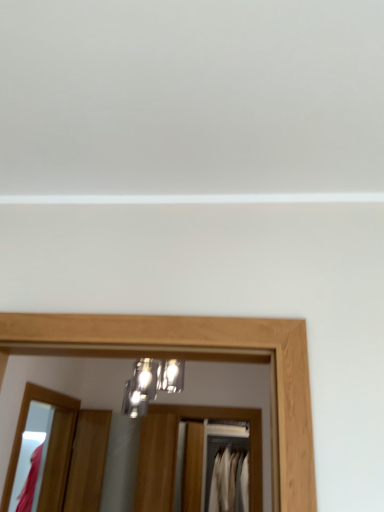
Image resolution: width=384 pixels, height=512 pixels. What do you see at coordinates (87, 461) in the screenshot?
I see `wooden door at lower left` at bounding box center [87, 461].

In order to face metallic glass light fixture at center, should I rotate leftwards or rightwards?

Rotate left and turn 5.225 degrees.

Image resolution: width=384 pixels, height=512 pixels. What are the coordinates of `metallic glass light fixture at center` in the screenshot? It's located at (151, 384).

This screenshot has height=512, width=384. Describe the element at coordinates (30, 482) in the screenshot. I see `matte pink fabric at left, the 2th clothing when ordered from right to left` at that location.

What is the approximate width of matte wooden mirror at lower left?

matte wooden mirror at lower left is 10.00 inches in width.

Identify the location of wooden door at lower left. The height and width of the screenshot is (512, 384). (87, 461).

Considering the relative sizes of wooden door at lower left and white fabric at center, acting as the second clothing starting from the front, in the image provided, is wooden door at lower left thinner than white fabric at center, acting as the second clothing starting from the front,?

Correct, the width of wooden door at lower left is less than that of white fabric at center, acting as the second clothing starting from the front.

This screenshot has width=384, height=512. I want to click on door above the white fabric at center, marked as the first clothing in a back-to-front arrangement (from a real-world perspective), so click(87, 461).

Considering their positions, is wooden door at lower left located in front of or behind white fabric at center, acting as the second clothing starting from the front?

wooden door at lower left is in front of white fabric at center, acting as the second clothing starting from the front.

Can we say matte pink fabric at left, the 2th clothing when ordered from right to left, lies outside metallic glass light fixture at center?

Absolutely, matte pink fabric at left, the 2th clothing when ordered from right to left, is external to metallic glass light fixture at center.

In the scene shown: Who is taller, matte pink fabric at left, the first clothing from the left, or metallic glass light fixture at center?

matte pink fabric at left, the first clothing from the left.

Which object is thinner, matte pink fabric at left, the 2th clothing when ordered from right to left, or metallic glass light fixture at center?

matte pink fabric at left, the 2th clothing when ordered from right to left.

From the image's perspective, which is below, white fabric at center, marked as the first clothing in a back-to-front arrangement, or metallic glass light fixture at center?

white fabric at center, marked as the first clothing in a back-to-front arrangement, appears lower in the image.

Does white fabric at center, which ranks as the 1th clothing in right-to-left order, have a larger size compared to metallic glass light fixture at center?

Yes.

Who is more distant, white fabric at center, acting as the second clothing starting from the front, or metallic glass light fixture at center?

white fabric at center, acting as the second clothing starting from the front, is further away from the camera.

Identify the location of light fixture above the white fabric at center, which ranks as the 1th clothing in right-to-left order (from the image's perspective). (151, 384).

Is wooden door at lower left surrounded by metallic glass light fixture at center?

No, metallic glass light fixture at center does not contain wooden door at lower left.

Considering the relative sizes of metallic glass light fixture at center and wooden door at lower left in the image provided, is metallic glass light fixture at center smaller than wooden door at lower left?

No, metallic glass light fixture at center is not smaller than wooden door at lower left.

Considering their positions, is metallic glass light fixture at center located in front of or behind wooden door at lower left?

Clearly, metallic glass light fixture at center is in front of wooden door at lower left.

Which is further, (41, 507) or (151, 384)?

The point (41, 507) is more distant.

In the scene shown: From a real-world perspective, is matte wooden mirror at lower left located beneath metallic glass light fixture at center?

Yes, from a real-world perspective, matte wooden mirror at lower left is beneath metallic glass light fixture at center.

In terms of width, does matte wooden mirror at lower left look wider or thinner when compared to metallic glass light fixture at center?

matte wooden mirror at lower left is wider than metallic glass light fixture at center.

Is matte wooden mirror at lower left in front of metallic glass light fixture at center?

No, matte wooden mirror at lower left is behind metallic glass light fixture at center.

From the image's perspective, which is above, metallic glass light fixture at center or white fabric at center, marked as the 2th clothing in a left-to-right arrangement?

metallic glass light fixture at center appears higher in the image.

Consider the image. Does metallic glass light fixture at center have a greater width compared to white fabric at center, marked as the 2th clothing in a left-to-right arrangement?

Incorrect, the width of metallic glass light fixture at center does not surpass that of white fabric at center, marked as the 2th clothing in a left-to-right arrangement.

In terms of height, does metallic glass light fixture at center look taller or shorter compared to white fabric at center, marked as the 2th clothing in a left-to-right arrangement?

metallic glass light fixture at center is shorter than white fabric at center, marked as the 2th clothing in a left-to-right arrangement.

Considering the positions of objects white fabric at center, acting as the second clothing starting from the front, and wooden door at lower left in the image provided, who is more to the right, white fabric at center, acting as the second clothing starting from the front, or wooden door at lower left?

Positioned to the right is white fabric at center, acting as the second clothing starting from the front.

Locate an element on the screen. The height and width of the screenshot is (512, 384). door in front of the white fabric at center, marked as the 2th clothing in a left-to-right arrangement is located at coordinates (87, 461).

How many degrees apart are the facing directions of white fabric at center, marked as the 2th clothing in a left-to-right arrangement, and wooden door at lower left?

The angle between the facing direction of white fabric at center, marked as the 2th clothing in a left-to-right arrangement, and the facing direction of wooden door at lower left is 12.7 degrees.

Is point (238, 489) positioned in front of point (83, 411)?

No, (238, 489) is further to viewer.

I want to click on door above the white fabric at center, marked as the first clothing in a back-to-front arrangement (from a real-world perspective), so click(87, 461).

I want to click on light fixture above the matte pink fabric at left, the second clothing in the back-to-front sequence (from the image's perspective), so (151, 384).

Looking at the image, which one is located closer to white fabric at center, marked as the first clothing in a back-to-front arrangement, wooden door at lower left or matte wooden mirror at lower left?

wooden door at lower left lies closer to white fabric at center, marked as the first clothing in a back-to-front arrangement, than the other object.

Which object lies further to the anchor point wooden door at lower left, white fabric at center, marked as the first clothing in a back-to-front arrangement, or metallic glass light fixture at center?

white fabric at center, marked as the first clothing in a back-to-front arrangement, is positioned further to the anchor wooden door at lower left.

Consider the image. Considering their positions, is matte pink fabric at left, the second clothing in the back-to-front sequence, positioned further to wooden door at lower left than white fabric at center, marked as the 2th clothing in a left-to-right arrangement?

white fabric at center, marked as the 2th clothing in a left-to-right arrangement, is positioned further to the anchor wooden door at lower left.

Based on the photo, looking at the image, which one is located closer to matte wooden mirror at lower left, metallic glass light fixture at center or white fabric at center, marked as the 2th clothing in a left-to-right arrangement?

Among the two, metallic glass light fixture at center is located nearer to matte wooden mirror at lower left.

Considering their positions, is wooden door at lower left positioned closer to matte pink fabric at left, the first clothing from the left, than matte wooden mirror at lower left?

The object closer to matte pink fabric at left, the first clothing from the left, is matte wooden mirror at lower left.

Considering their positions, is matte pink fabric at left, the 2th clothing when ordered from right to left, positioned further to metallic glass light fixture at center than wooden door at lower left?

matte pink fabric at left, the 2th clothing when ordered from right to left.

Considering their positions, is matte pink fabric at left, the 2th clothing when ordered from right to left, positioned closer to matte wooden mirror at lower left than wooden door at lower left?

wooden door at lower left is closer to matte wooden mirror at lower left.

Based on the photo, which object lies nearer to the anchor point metallic glass light fixture at center, matte wooden mirror at lower left or matte pink fabric at left, the 2th clothing when ordered from right to left?

matte wooden mirror at lower left.

This screenshot has height=512, width=384. Identify the location of clothing between metallic glass light fixture at center and white fabric at center, which ranks as the 1th clothing in right-to-left order, from front to back. (30, 482).

Locate an element on the screen. door positioned between matte wooden mirror at lower left and matte pink fabric at left, the first clothing from the left, from near to far is located at coordinates (87, 461).

The height and width of the screenshot is (512, 384). Find the location of `mirror between metallic glass light fixture at center and white fabric at center, marked as the 2th clothing in a left-to-right arrangement, in the front-back direction`. mirror between metallic glass light fixture at center and white fabric at center, marked as the 2th clothing in a left-to-right arrangement, in the front-back direction is located at coordinates (48, 447).

At what (x,y) coordinates should I click in order to perform the action: click on door located between metallic glass light fixture at center and matte pink fabric at left, the 2th clothing when ordered from right to left, in the depth direction. Please return your answer as a coordinate pair (x, y). Looking at the image, I should click on (87, 461).